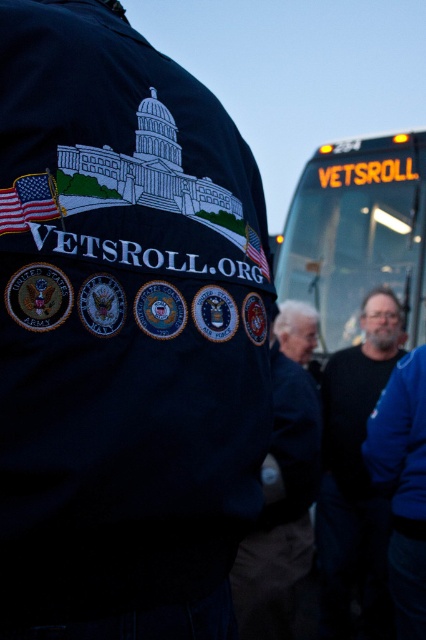
You are standing at the camera position and want to pick up the blue denim jacket at lower right. Is the jacket within your reach?

The blue denim jacket at lower right and camera are 3.76 meters apart, so the jacket is too far to reach from the camera position.

In the scene shown: You are a pedestrian standing on the sidewalk looking at the scene. Which object is closer to you, the translucent glass bus at center or the blue denim jacket at lower right?

The blue denim jacket at lower right is closer to you because the translucent glass bus at center is positioned over it, indicating it is further away.

You are a tailor measuring jackets for alterations. You have a blue denim jacket at lower right and a dark blue jacket at center. Which jacket has a greater width?

The blue denim jacket at lower right has a greater width than the dark blue jacket at center according to the description.